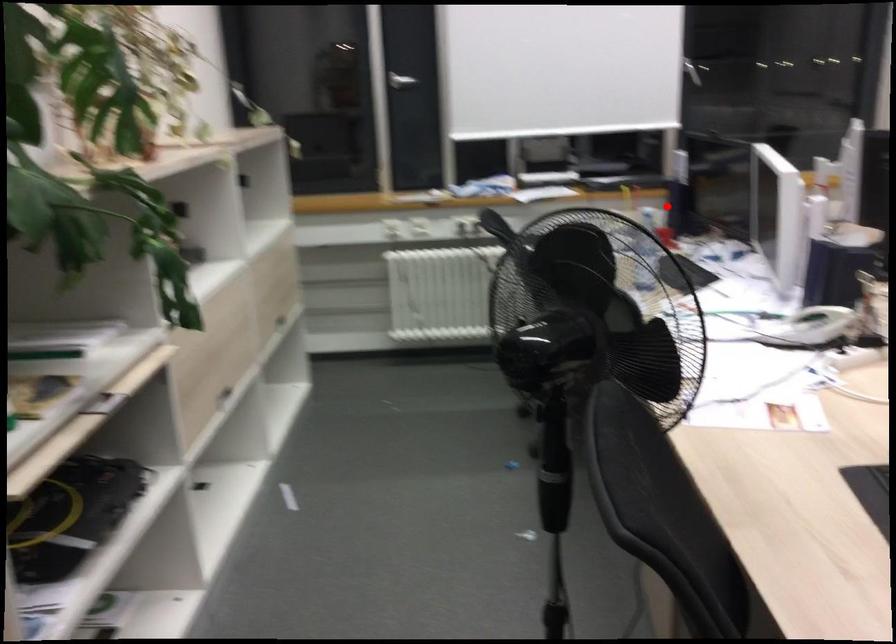
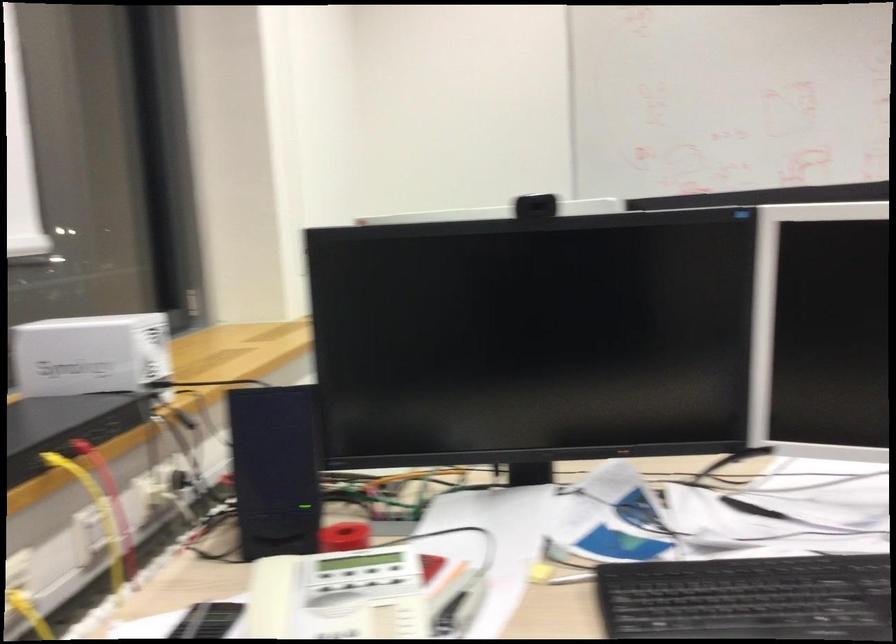
Question: I am providing you with two images of the same scene from different viewpoints. Image1 has a red point marked. In image2, the corresponding 3D location appears at what relative position? Reply with the corresponding letter.

Choices:
 (A) Closer
 (B) Farther

Answer: (A)